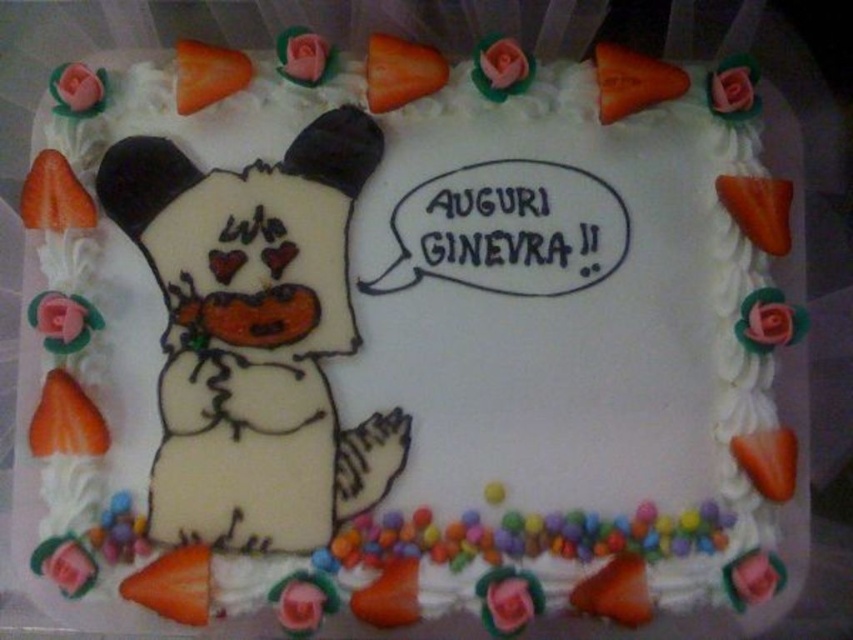
Question: In this image, where is orange matte carrot at lower left located relative to orange matte carrot at upper left?

Choices:
 (A) below
 (B) above

Answer: (A)

Question: Is white fondant snowman at center below orange matte carrot at upper left?

Choices:
 (A) yes
 (B) no

Answer: (A)

Question: Which of the following is the farthest from the observer?

Choices:
 (A) (276, 531)
 (B) (199, 60)
 (C) (55, 445)

Answer: (B)

Question: Which of the following is the farthest from the observer?

Choices:
 (A) white fondant snowman at center
 (B) orange matte carrot at lower left
 (C) orange matte carrot at upper left

Answer: (C)

Question: Which of the following is the farthest from the observer?

Choices:
 (A) 193,70
 (B) 51,403
 (C) 209,364

Answer: (A)

Question: Does orange matte carrot at lower left have a smaller size compared to orange matte carrot at upper left?

Choices:
 (A) yes
 (B) no

Answer: (A)